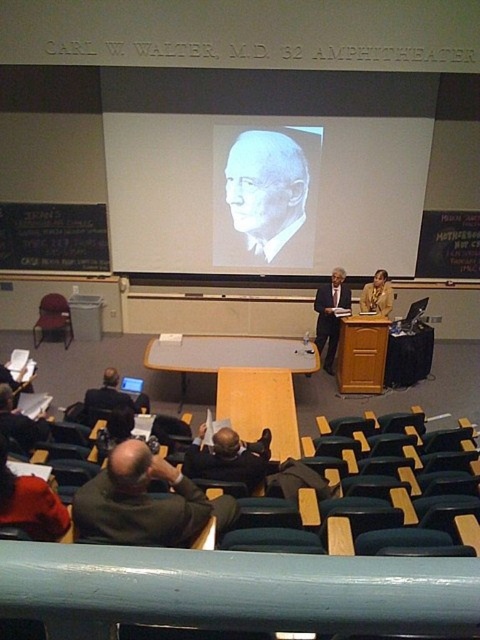
Question: Which point is farther to the camera?

Choices:
 (A) 241,192
 (B) 215,438
 (C) 135,465

Answer: (A)

Question: Which object appears farthest from the camera in this image?

Choices:
 (A) red knit cap at lower left
 (B) matte plastic chair at left

Answer: (B)

Question: Is dark green sweater at lower left thinner than dark brown leather jacket at center?

Choices:
 (A) yes
 (B) no

Answer: (B)

Question: Which of the following is the farthest from the observer?

Choices:
 (A) matte black laptop at left
 (B) dark green sweater at lower left
 (C) gray matte portrait at center

Answer: (C)

Question: Is gray matte portrait at center closer to camera compared to dark green sweater at lower left?

Choices:
 (A) yes
 (B) no

Answer: (B)

Question: Does red knit cap at lower left appear on the right side of dark suit at center?

Choices:
 (A) no
 (B) yes

Answer: (A)